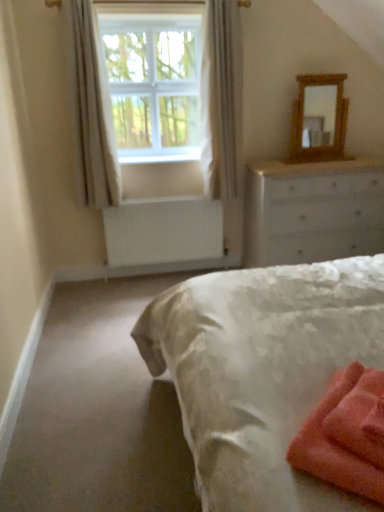
Find the location of a particular element. The height and width of the screenshot is (512, 384). white sheer curtain at upper left, arranged as the 1th curtain when viewed from the left is located at coordinates (92, 112).

Describe the element at coordinates (163, 157) in the screenshot. This screenshot has height=512, width=384. I see `white painted wood at lower center` at that location.

The width and height of the screenshot is (384, 512). In order to click on white sheer curtain at upper left, marked as the second curtain in a right-to-left arrangement in this screenshot , I will do `click(92, 112)`.

Consider the image. How different are the orientations of white painted wood chest of drawers at upper right and white plastic window screen at upper center in degrees?

white painted wood chest of drawers at upper right and white plastic window screen at upper center are facing 0.239 degrees away from each other.

Which is in front, point (291, 227) or point (156, 20)?

The point (156, 20) is closer.

Considering the sizes of objects white painted wood chest of drawers at upper right and white plastic window screen at upper center in the image provided, who is wider, white painted wood chest of drawers at upper right or white plastic window screen at upper center?

white painted wood chest of drawers at upper right is wider.

Is white sheer curtain at upper left, which is counted as the second curtain, starting from the left, further to the viewer compared to soft coral towel at lower right?

That is True.

From a real-world perspective, is white sheer curtain at upper left, which is counted as the second curtain, starting from the left, physically above soft coral towel at lower right?

Correct, in the physical world, white sheer curtain at upper left, which is counted as the second curtain, starting from the left, is higher than soft coral towel at lower right.

Does white sheer curtain at upper left, which is counted as the second curtain, starting from the left, have a larger size compared to soft coral towel at lower right?

Yes.

In the scene shown: Who is bigger, wooden mirror at upper right or white painted wood chest of drawers at upper right?

white painted wood chest of drawers at upper right is bigger.

From the image's perspective, is wooden mirror at upper right beneath white painted wood chest of drawers at upper right?

No.

Is wooden mirror at upper right next to white painted wood chest of drawers at upper right?

wooden mirror at upper right and white painted wood chest of drawers at upper right are not in contact.

Considering the sizes of wooden mirror at upper right and white painted wood chest of drawers at upper right in the image, is wooden mirror at upper right wider or thinner than white painted wood chest of drawers at upper right?

In the image, wooden mirror at upper right appears to be more narrow than white painted wood chest of drawers at upper right.

From a real-world perspective, is white painted wood chest of drawers at upper right over white painted wood at lower center?

No.

Which is correct: white painted wood chest of drawers at upper right is inside white painted wood at lower center, or outside of it?

white painted wood chest of drawers at upper right is not enclosed by white painted wood at lower center.

Is white painted wood chest of drawers at upper right facing towards white painted wood at lower center?

No, white painted wood chest of drawers at upper right is not turned towards white painted wood at lower center.

This screenshot has width=384, height=512. Find the location of `the chest of drawers that appears below the white painted wood at lower center (from the image's perspective)`. the chest of drawers that appears below the white painted wood at lower center (from the image's perspective) is located at coordinates (313, 211).

From the image's perspective, which one is positioned higher, white plastic window screen at upper center or white sheer curtain at upper left, arranged as the 1th curtain when viewed from the left?

white plastic window screen at upper center, from the image's perspective.

Could you tell me if white plastic window screen at upper center is turned towards white sheer curtain at upper left, arranged as the 1th curtain when viewed from the left?

No, white plastic window screen at upper center is not turned towards white sheer curtain at upper left, arranged as the 1th curtain when viewed from the left.

Measure the distance between white plastic window screen at upper center and white sheer curtain at upper left, arranged as the 1th curtain when viewed from the left.

They are 53.79 centimeters apart.

Can you tell me how much white sheer curtain at upper left, marked as the 1th curtain in a right-to-left arrangement, and white plastic window screen at upper center differ in facing direction?

The facing directions of white sheer curtain at upper left, marked as the 1th curtain in a right-to-left arrangement, and white plastic window screen at upper center are 0.00438 degrees apart.

Considering the relative sizes of white sheer curtain at upper left, marked as the 1th curtain in a right-to-left arrangement, and white plastic window screen at upper center in the image provided, is white sheer curtain at upper left, marked as the 1th curtain in a right-to-left arrangement, taller than white plastic window screen at upper center?

Correct, white sheer curtain at upper left, marked as the 1th curtain in a right-to-left arrangement, is much taller as white plastic window screen at upper center.

From a real-world perspective, between white sheer curtain at upper left, marked as the 1th curtain in a right-to-left arrangement, and white plastic window screen at upper center, who is vertically higher?

white plastic window screen at upper center, from a real-world perspective.

Is white sheer curtain at upper left, marked as the 1th curtain in a right-to-left arrangement, not within white plastic window screen at upper center?

Yes.

From a real-world perspective, relative to white plastic window screen at upper center, is wooden mirror at upper right vertically above or below?

Clearly, from a real-world perspective, wooden mirror at upper right is below white plastic window screen at upper center.

From the image's perspective, would you say wooden mirror at upper right is positioned over white plastic window screen at upper center?

No, from the image's perspective, wooden mirror at upper right is not over white plastic window screen at upper center.

Which of these two, wooden mirror at upper right or white plastic window screen at upper center, is wider?

white plastic window screen at upper center is wider.

Does wooden mirror at upper right have a lesser height compared to white plastic window screen at upper center?

Correct, wooden mirror at upper right is not as tall as white plastic window screen at upper center.

Locate an element on the screen. the chest of drawers directly beneath the white plastic window screen at upper center (from a real-world perspective) is located at coordinates (313, 211).

From the soft coral towel at lower right, count 2nd curtains backward and point to it. Please provide its 2D coordinates.

[(221, 99)]

From the image, which object appears to be nearer to white painted wood chest of drawers at upper right, white sheer curtain at upper left, marked as the 1th curtain in a right-to-left arrangement, or white plastic window screen at upper center?

white sheer curtain at upper left, marked as the 1th curtain in a right-to-left arrangement, is positioned closer to the anchor white painted wood chest of drawers at upper right.

Estimate the real-world distances between objects in this image. Which object is closer to soft coral towel at lower right, white sheer curtain at upper left, which is counted as the second curtain, starting from the left, or white painted wood chest of drawers at upper right?

white painted wood chest of drawers at upper right is closer to soft coral towel at lower right.

Based on their spatial positions, is soft coral towel at lower right or white painted wood at lower center closer to white sheer curtain at upper left, marked as the 1th curtain in a right-to-left arrangement?

white painted wood at lower center.

From the image, which object appears to be nearer to soft coral towel at lower right, white painted wood chest of drawers at upper right or white plastic window screen at upper center?

white painted wood chest of drawers at upper right is positioned closer to the anchor soft coral towel at lower right.

From the image, which object appears to be farther from wooden mirror at upper right, white sheer curtain at upper left, marked as the 1th curtain in a right-to-left arrangement, or white painted wood at lower center?

Among the two, white painted wood at lower center is located further to wooden mirror at upper right.

When comparing their distances from white painted wood chest of drawers at upper right, does white sheer curtain at upper left, which is counted as the second curtain, starting from the left, or white sheer curtain at upper left, marked as the second curtain in a right-to-left arrangement, seem closer?

Among the two, white sheer curtain at upper left, which is counted as the second curtain, starting from the left, is located nearer to white painted wood chest of drawers at upper right.

Which object lies further to the anchor point white sheer curtain at upper left, arranged as the 1th curtain when viewed from the left, white plastic window screen at upper center or wooden mirror at upper right?

wooden mirror at upper right is positioned further to the anchor white sheer curtain at upper left, arranged as the 1th curtain when viewed from the left.

Looking at the image, which one is located further to wooden mirror at upper right, white painted wood chest of drawers at upper right or white plastic window screen at upper center?

white plastic window screen at upper center.

The image size is (384, 512). In order to click on window screen positioned between soft coral towel at lower right and white painted wood chest of drawers at upper right from near to far in this screenshot , I will do `click(153, 82)`.

Locate an element on the screen. mirror located between white sheer curtain at upper left, which is counted as the second curtain, starting from the left, and white painted wood chest of drawers at upper right in the left-right direction is located at coordinates (319, 118).

You are a GUI agent. You are given a task and a screenshot of the screen. Output one action in this format:
    pyautogui.click(x=<x>, y=<y>)
    Task: Click on the chest of drawers positioned between soft coral towel at lower right and white painted wood at lower center from near to far
    The height and width of the screenshot is (512, 384).
    Given the screenshot: What is the action you would take?
    pyautogui.click(x=313, y=211)

Locate an element on the screen. Image resolution: width=384 pixels, height=512 pixels. window sill situated between white sheer curtain at upper left, arranged as the 1th curtain when viewed from the left, and wooden mirror at upper right from left to right is located at coordinates (163, 157).